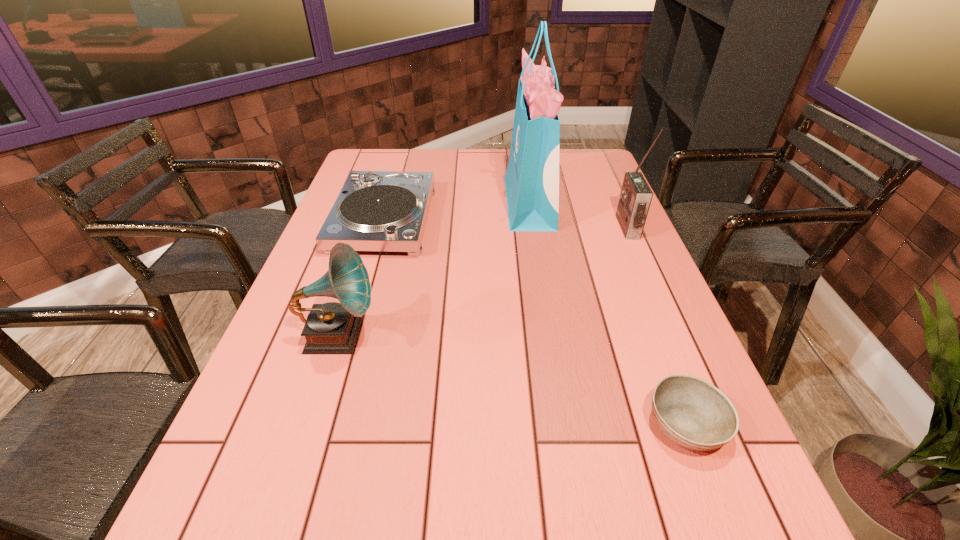
In the image, there is a desktop. Where is `free space at the far edge`? The width and height of the screenshot is (960, 540). free space at the far edge is located at coordinates (439, 152).

In the image, there is a desktop. Find the location of `free space at the near edge`. free space at the near edge is located at coordinates (396, 528).

Identify the location of vacant space at the left edge. Image resolution: width=960 pixels, height=540 pixels. (306, 416).

The image size is (960, 540). Identify the location of vacant space at the right edge of the desktop. (582, 184).

Where is `vacant space at the far right corner of the desktop`? The image size is (960, 540). vacant space at the far right corner of the desktop is located at coordinates (602, 155).

At what (x,y) coordinates should I click in order to perform the action: click on free space that is in between the bowl and the second nearest object. Please return your answer as a coordinate pair (x, y). Looking at the image, I should click on (512, 380).

Where is `empty space between the tallest object and the bowl`? The height and width of the screenshot is (540, 960). empty space between the tallest object and the bowl is located at coordinates (608, 313).

Locate an element on the screen. The height and width of the screenshot is (540, 960). empty space between the fourth tallest object and the shortest object is located at coordinates (x=535, y=322).

At what (x,y) coordinates should I click in order to perform the action: click on free space between the phonograph_record and the fourth shortest object. Please return your answer as a coordinate pair (x, y). Image resolution: width=960 pixels, height=540 pixels. Looking at the image, I should click on (483, 281).

Where is `free spot between the radio receiver and the bowl`? free spot between the radio receiver and the bowl is located at coordinates (657, 326).